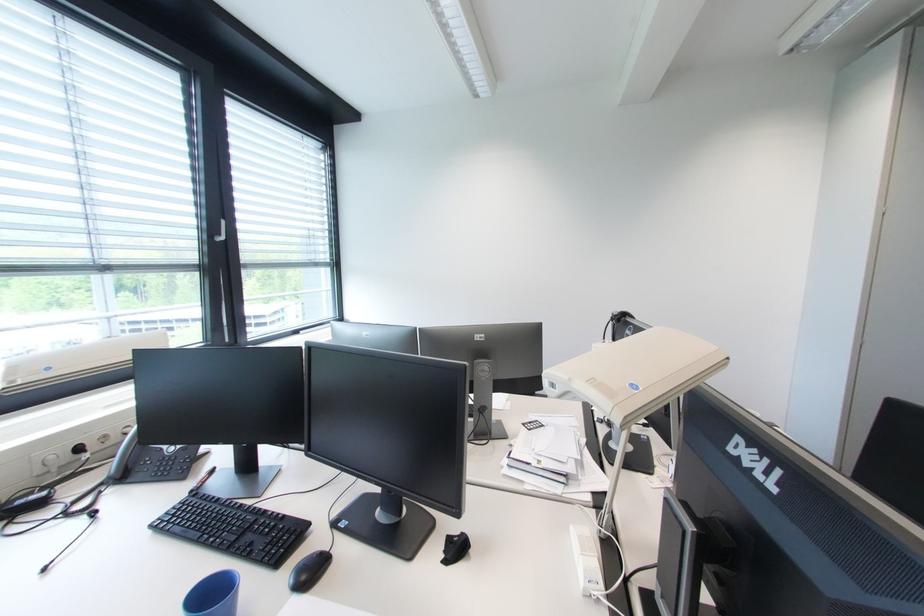
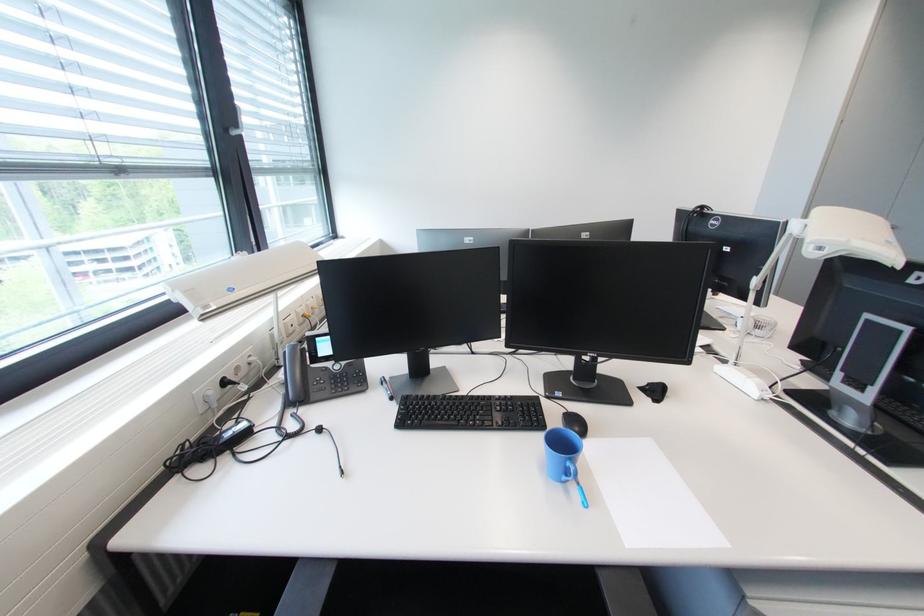
Locate, in the second image, the point that corresponds to (x=577, y=381) in the first image.

(856, 243)